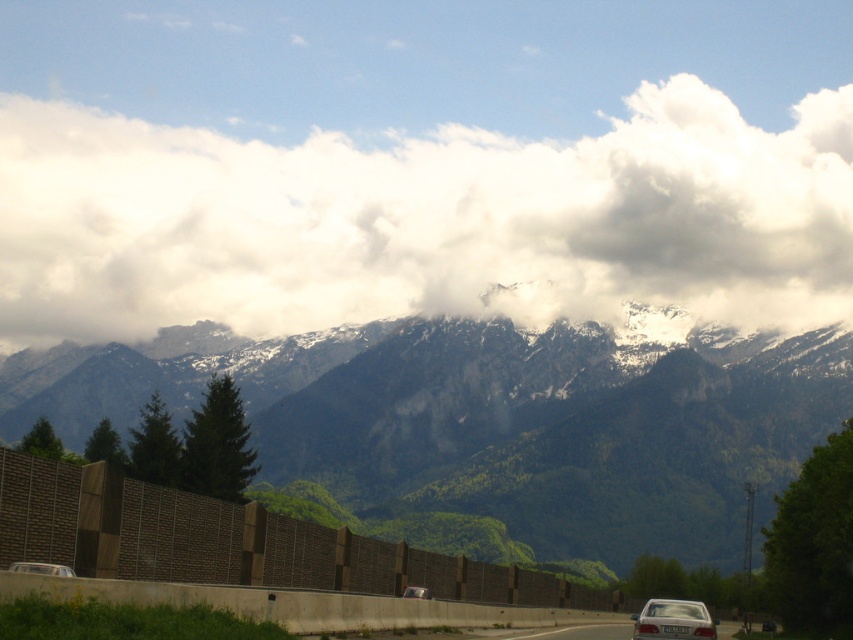
This screenshot has height=640, width=853. Describe the element at coordinates (41, 568) in the screenshot. I see `white glossy car at lower left` at that location.

The image size is (853, 640). Find the location of `white glossy car at lower left`. white glossy car at lower left is located at coordinates (41, 568).

Between snowy rock mountain range at center and white glossy car at lower left, which one has less height?

With less height is white glossy car at lower left.

Looking at this image, how much distance is there between snowy rock mountain range at center and white glossy car at lower left?

They are 272.65 meters apart.

Which is behind, point (410, 387) or point (54, 572)?

The point (410, 387) is behind.

Locate an element on the screen. The height and width of the screenshot is (640, 853). snowy rock mountain range at center is located at coordinates (506, 428).

Where is `white fluffy cloud at upper center`? This screenshot has height=640, width=853. white fluffy cloud at upper center is located at coordinates (425, 221).

The image size is (853, 640). In order to click on white fluffy cloud at upper center in this screenshot , I will do `click(425, 221)`.